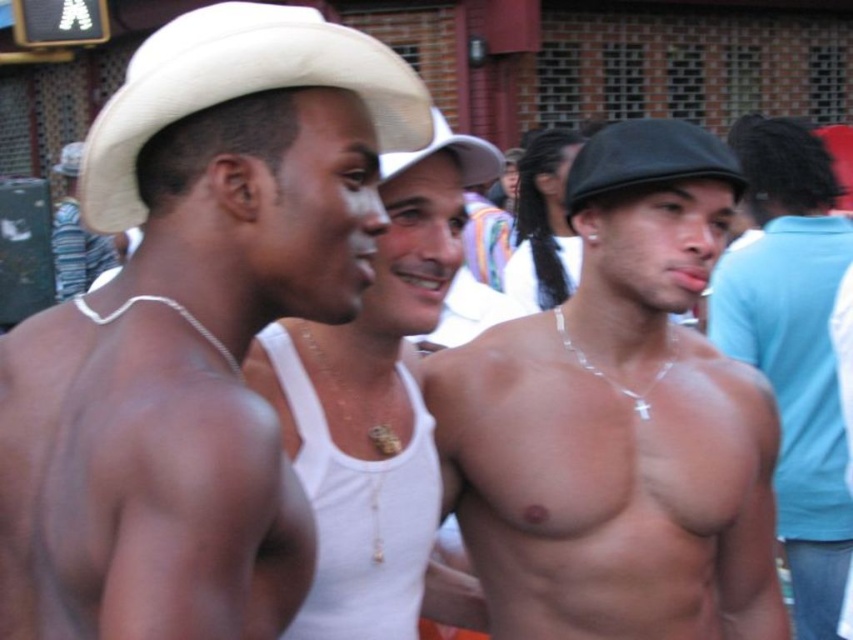
Can you confirm if shiny silver necklace at center is smaller than matte white cowboy hat at left?

Incorrect, shiny silver necklace at center is not smaller in size than matte white cowboy hat at left.

Which is above, shiny silver necklace at center or matte white cowboy hat at left?

Positioned higher is matte white cowboy hat at left.

The width and height of the screenshot is (853, 640). In order to click on shiny silver necklace at center in this screenshot , I will do `click(618, 420)`.

Is white matte cowboy hat at upper left further to the viewer compared to matte white cowboy hat at left?

No, white matte cowboy hat at upper left is in front of matte white cowboy hat at left.

Does white matte cowboy hat at upper left have a greater height compared to matte white cowboy hat at left?

Yes, white matte cowboy hat at upper left is taller than matte white cowboy hat at left.

Between point (22, 384) and point (74, 243), which one is positioned in front?

Point (22, 384)

Find the location of a particular element. Image resolution: width=853 pixels, height=640 pixels. white matte cowboy hat at upper left is located at coordinates (193, 330).

Is white matte cowboy hat at upper left wider than shiny silver necklace at center?

No.

Does white matte cowboy hat at upper left have a larger size compared to shiny silver necklace at center?

Correct, white matte cowboy hat at upper left is larger in size than shiny silver necklace at center.

Locate an element on the screen. This screenshot has height=640, width=853. white matte cowboy hat at upper left is located at coordinates (193, 330).